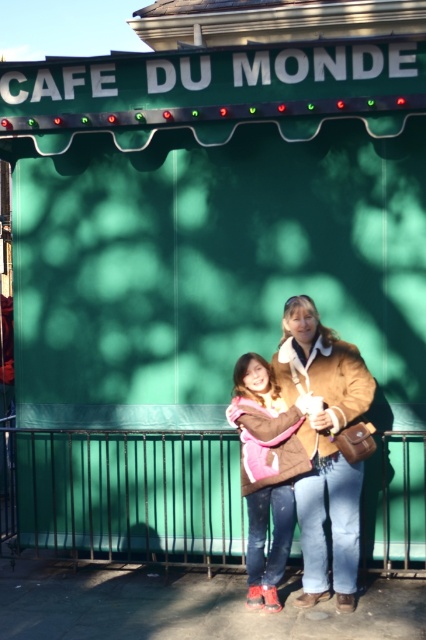
What is located at the coordinates point (325, 448)?

The brown suede jacket at center is located at point (325, 448).

You are trying to take a photo of the brown fuzzy jacket at center and the brown suede jacket at center in the scene. Which jacket is partially hidden from view?

The brown fuzzy jacket at center is partially hidden because it is behind the brown suede jacket at center.

You are trying to decide which jacket to buy. You see two jackets in the image, a brown suede jacket at center and a brown fuzzy jacket at center. Which one is larger?

The brown suede jacket at center is bigger than the brown fuzzy jacket at center.